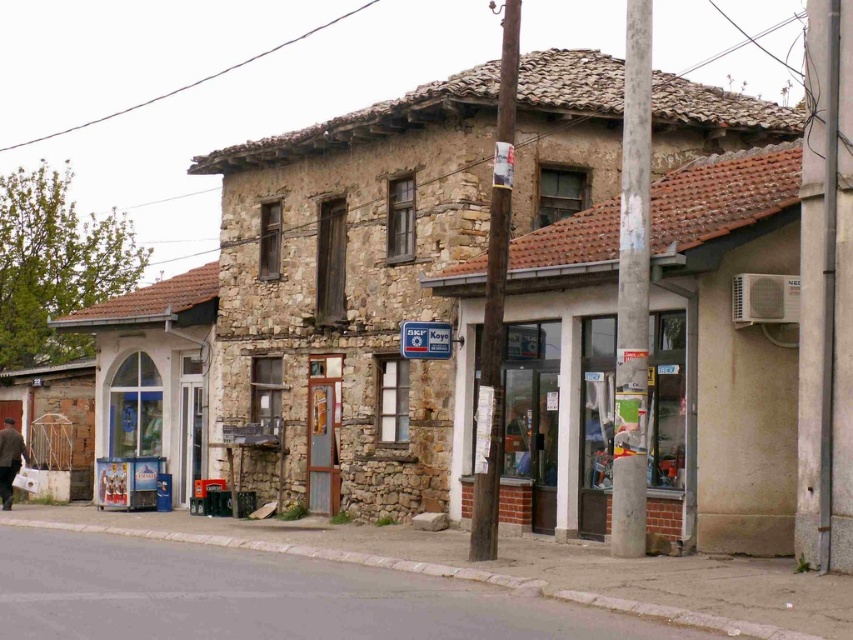
Question: From the image, what is the correct spatial relationship of clear glass door at center in relation to brown wool coat at lower left?

Choices:
 (A) below
 (B) above

Answer: (B)

Question: Does clear glass door at center have a greater width compared to brown wool coat at lower left?

Choices:
 (A) no
 (B) yes

Answer: (B)

Question: Among these points, which one is nearest to the camera?

Choices:
 (A) (654, 394)
 (B) (3, 499)

Answer: (A)

Question: Does clear glass door at center have a larger size compared to brown wool coat at lower left?

Choices:
 (A) no
 (B) yes

Answer: (B)